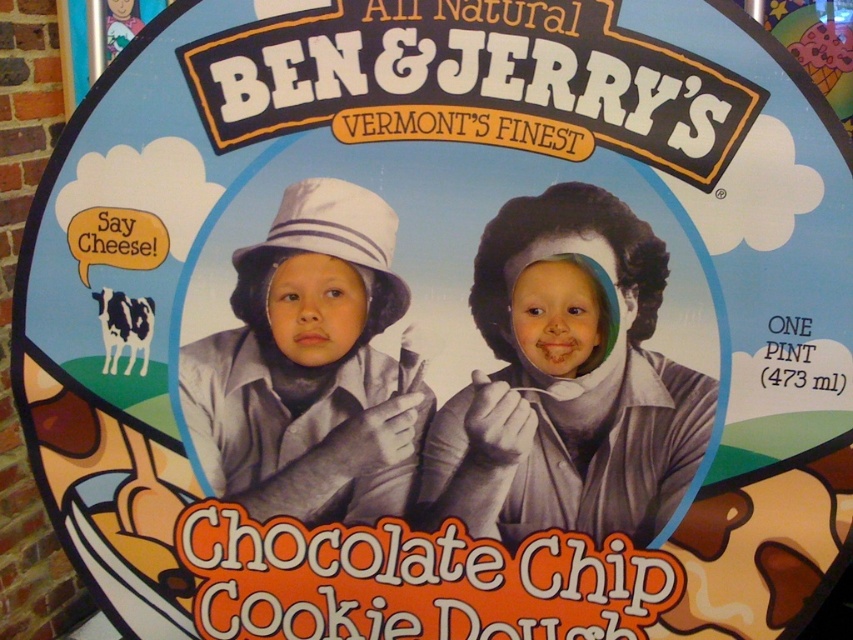
You are designing a layout for a poster and need to ensure that the smooth chocolate at upper right and the white matte hat at center are spaced appropriately. Given that the minimum required spacing between elements is 30 centimeters for readability, will the current distance of 28.94 centimeters between them meet the requirement?

The distance between the smooth chocolate at upper right and the white matte hat at center is 28.94 centimeters, which is less than the required 30 centimeters. Therefore, the spacing does not meet the readability requirement.

Looking at the Ben and Jerry poster, where is the smooth chocolate at upper right in relation to the white matte hat at center?

The smooth chocolate at upper right is located below the white matte hat at center.